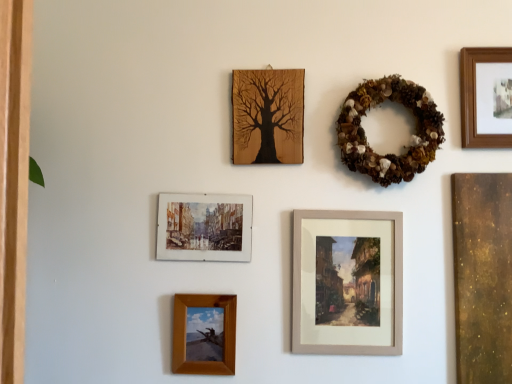
Describe the element at coordinates (347, 282) in the screenshot. I see `wooden framed painting at center, the fourth picture frame in the left-to-right sequence` at that location.

The image size is (512, 384). In order to click on wooden framed painting at center, the fourth picture frame in the left-to-right sequence in this screenshot , I will do tap(347, 282).

Find the location of a particular element. Image resolution: width=512 pixels, height=384 pixels. wooden frame at lower center, which appears as the 5th picture frame when viewed from the right is located at coordinates (204, 335).

Locate an element on the screen. Image resolution: width=512 pixels, height=384 pixels. wooden framed painting at center, placed as the 2th picture frame when sorted from right to left is located at coordinates (347, 282).

Is wooden frame at upper right, the 1th picture frame viewed from the right, oriented towards watercolor paper painting at upper left, arranged as the fourth picture frame when viewed from the right?

No.

Which object is closer to the camera taking this photo, wooden frame at upper right, which is the 5th picture frame in left-to-right order, or watercolor paper painting at upper left, the 2th picture frame when ordered from left to right?

wooden frame at upper right, which is the 5th picture frame in left-to-right order, is in front.

Locate an element on the screen. The image size is (512, 384). the 2nd picture frame located beneath the wooden frame at upper right, which is the 5th picture frame in left-to-right order (from a real-world perspective) is located at coordinates (204, 227).

Is wooden frame at upper right, the 1th picture frame viewed from the right, surrounding watercolor paper painting at upper left, arranged as the fourth picture frame when viewed from the right?

No, watercolor paper painting at upper left, arranged as the fourth picture frame when viewed from the right, is located outside of wooden frame at upper right, the 1th picture frame viewed from the right.

Which of these two, wooden framed painting at center, placed as the 2th picture frame when sorted from right to left, or watercolor paper painting at upper left, the 2th picture frame when ordered from left to right, is bigger?

wooden framed painting at center, placed as the 2th picture frame when sorted from right to left, is bigger.

Which of these two, wooden framed painting at center, placed as the 2th picture frame when sorted from right to left, or watercolor paper painting at upper left, arranged as the fourth picture frame when viewed from the right, stands shorter?

watercolor paper painting at upper left, arranged as the fourth picture frame when viewed from the right, is shorter.

Can you tell me how much wooden framed painting at center, the fourth picture frame in the left-to-right sequence, and watercolor paper painting at upper left, arranged as the fourth picture frame when viewed from the right, differ in facing direction?

They differ by 0.000639 degrees in their facing directions.

Would you say wooden framed painting at center, the fourth picture frame in the left-to-right sequence, is to the left or to the right of watercolor paper painting at upper left, the 2th picture frame when ordered from left to right, in the picture?

In the image, wooden framed painting at center, the fourth picture frame in the left-to-right sequence, appears on the right side of watercolor paper painting at upper left, the 2th picture frame when ordered from left to right.

Based on the photo, is wooden frame at lower center, which appears as the 5th picture frame when viewed from the right, bigger than watercolor paper painting at upper left, arranged as the fourth picture frame when viewed from the right?

No, wooden frame at lower center, which appears as the 5th picture frame when viewed from the right, is not bigger than watercolor paper painting at upper left, arranged as the fourth picture frame when viewed from the right.

From the image's perspective, which object appears higher, wooden frame at lower center, which appears as the 5th picture frame when viewed from the right, or watercolor paper painting at upper left, arranged as the fourth picture frame when viewed from the right?

watercolor paper painting at upper left, arranged as the fourth picture frame when viewed from the right, is shown above in the image.

From the image's perspective, starting from the watercolor paper painting at upper left, the 2th picture frame when ordered from left to right, which picture frame is the 2nd one below? Please provide its 2D coordinates.

[(204, 335)]

Is wooden frame at lower center, which appears as the 5th picture frame when viewed from the right, touching watercolor paper painting at upper left, the 2th picture frame when ordered from left to right?

There is a gap between wooden frame at lower center, which appears as the 5th picture frame when viewed from the right, and watercolor paper painting at upper left, the 2th picture frame when ordered from left to right.

Do you think wooden frame at upper right, which is the 5th picture frame in left-to-right order, is within wooden tree art at upper center, which is the third picture frame from right to left, or outside of it?

wooden frame at upper right, which is the 5th picture frame in left-to-right order, cannot be found inside wooden tree art at upper center, which is the third picture frame from right to left.

Would you say wooden frame at upper right, which is the 5th picture frame in left-to-right order, is to the left or to the right of wooden tree art at upper center, which is the third picture frame from left to right, in the picture?

Based on their positions, wooden frame at upper right, which is the 5th picture frame in left-to-right order, is located to the right of wooden tree art at upper center, which is the third picture frame from left to right.

How many degrees apart are the facing directions of wooden frame at upper right, the 1th picture frame viewed from the right, and wooden tree art at upper center, which is the third picture frame from left to right?

0.00173 degrees separate the facing orientations of wooden frame at upper right, the 1th picture frame viewed from the right, and wooden tree art at upper center, which is the third picture frame from left to right.

Locate an element on the screen. This screenshot has width=512, height=384. the 1st picture frame positioned below the wooden frame at upper right, which is the 5th picture frame in left-to-right order (from a real-world perspective) is located at coordinates (268, 116).

From a real-world perspective, which object stands above the other?

wooden tree art at upper center, which is the third picture frame from right to left, is physically above.

Does wooden framed painting at center, placed as the 2th picture frame when sorted from right to left, have a lesser height compared to wooden tree art at upper center, which is the third picture frame from left to right?

Incorrect, the height of wooden framed painting at center, placed as the 2th picture frame when sorted from right to left, does not fall short of that of wooden tree art at upper center, which is the third picture frame from left to right.

Is wooden framed painting at center, placed as the 2th picture frame when sorted from right to left, closer to the viewer compared to wooden tree art at upper center, which is the third picture frame from right to left?

Yes, it is.

Does point (346, 272) come in front of point (300, 148)?

That is True.

Is point (163, 206) positioned behind point (313, 218)?

That is True.

Is watercolor paper painting at upper left, arranged as the fourth picture frame when viewed from the right, outside of wooden framed painting at center, placed as the 2th picture frame when sorted from right to left?

That's correct, watercolor paper painting at upper left, arranged as the fourth picture frame when viewed from the right, is outside of wooden framed painting at center, placed as the 2th picture frame when sorted from right to left.

Considering the sizes of watercolor paper painting at upper left, arranged as the fourth picture frame when viewed from the right, and wooden framed painting at center, placed as the 2th picture frame when sorted from right to left, in the image, is watercolor paper painting at upper left, arranged as the fourth picture frame when viewed from the right, wider or thinner than wooden framed painting at center, placed as the 2th picture frame when sorted from right to left,?

Considering their sizes, watercolor paper painting at upper left, arranged as the fourth picture frame when viewed from the right, looks slimmer than wooden framed painting at center, placed as the 2th picture frame when sorted from right to left.

This screenshot has width=512, height=384. What are the coordinates of `picture frame lying below the wooden framed painting at center, the fourth picture frame in the left-to-right sequence (from the image's perspective)` in the screenshot? It's located at (204, 335).

Is wooden frame at lower center, which is the first picture frame in left-to-right order, in contact with wooden framed painting at center, placed as the 2th picture frame when sorted from right to left?

No, wooden frame at lower center, which is the first picture frame in left-to-right order, is not next to wooden framed painting at center, placed as the 2th picture frame when sorted from right to left.

Can you tell me how much wooden frame at lower center, which is the first picture frame in left-to-right order, and wooden framed painting at center, placed as the 2th picture frame when sorted from right to left, differ in facing direction?

wooden frame at lower center, which is the first picture frame in left-to-right order, and wooden framed painting at center, placed as the 2th picture frame when sorted from right to left, are facing 0.00539 degrees away from each other.

From the image's perspective, is wooden frame at lower center, which is the first picture frame in left-to-right order, located beneath wooden framed painting at center, placed as the 2th picture frame when sorted from right to left?

Indeed, from the image's perspective, wooden frame at lower center, which is the first picture frame in left-to-right order, is shown beneath wooden framed painting at center, placed as the 2th picture frame when sorted from right to left.

You are a GUI agent. You are given a task and a screenshot of the screen. Output one action in this format:
    pyautogui.click(x=<x>, y=<y>)
    Task: Click on the picture frame that is the 2nd object located above the watercolor paper painting at upper left, arranged as the fourth picture frame when viewed from the right (from the image's perspective)
    The image size is (512, 384).
    Given the screenshot: What is the action you would take?
    (x=486, y=97)

Where is `picture frame that is the 1st object located below the watercolor paper painting at upper left, arranged as the fourth picture frame when viewed from the right (from the image's perspective)`? The image size is (512, 384). picture frame that is the 1st object located below the watercolor paper painting at upper left, arranged as the fourth picture frame when viewed from the right (from the image's perspective) is located at coordinates 347,282.

Looking at the image, which one is located further to wooden tree art at upper center, which is the third picture frame from left to right, brown textured wreath at upper right or wooden frame at upper right, the 1th picture frame viewed from the right?

wooden frame at upper right, the 1th picture frame viewed from the right, is positioned further to the anchor wooden tree art at upper center, which is the third picture frame from left to right.

Estimate the real-world distances between objects in this image. Which object is closer to wooden frame at lower center, which appears as the 5th picture frame when viewed from the right, wooden frame at upper right, which is the 5th picture frame in left-to-right order, or wooden tree art at upper center, which is the third picture frame from left to right?

Based on the image, wooden tree art at upper center, which is the third picture frame from left to right, appears to be nearer to wooden frame at lower center, which appears as the 5th picture frame when viewed from the right.

When comparing their distances from wooden tree art at upper center, which is the third picture frame from left to right, does wooden framed painting at center, placed as the 2th picture frame when sorted from right to left, or wooden frame at lower center, which appears as the 5th picture frame when viewed from the right, seem further?

wooden frame at lower center, which appears as the 5th picture frame when viewed from the right, is positioned further to the anchor wooden tree art at upper center, which is the third picture frame from left to right.

Looking at the image, which one is located closer to brown textured wreath at upper right, wooden frame at lower center, which is the first picture frame in left-to-right order, or wooden frame at upper right, the 1th picture frame viewed from the right?

wooden frame at upper right, the 1th picture frame viewed from the right.

From the image, which object appears to be nearer to wooden tree art at upper center, which is the third picture frame from right to left, watercolor paper painting at upper left, the 2th picture frame when ordered from left to right, or brown textured wreath at upper right?

brown textured wreath at upper right is positioned closer to the anchor wooden tree art at upper center, which is the third picture frame from right to left.

Looking at the image, which one is located further to wooden tree art at upper center, which is the third picture frame from left to right, wooden frame at upper right, the 1th picture frame viewed from the right, or brown textured wreath at upper right?

The object further to wooden tree art at upper center, which is the third picture frame from left to right, is wooden frame at upper right, the 1th picture frame viewed from the right.

Based on their spatial positions, is wooden tree art at upper center, which is the third picture frame from right to left, or wooden frame at lower center, which appears as the 5th picture frame when viewed from the right, further from brown textured wreath at upper right?

wooden frame at lower center, which appears as the 5th picture frame when viewed from the right, is further to brown textured wreath at upper right.

Looking at the image, which one is located closer to wooden frame at upper right, which is the 5th picture frame in left-to-right order, wooden tree art at upper center, which is the third picture frame from left to right, or brown textured wreath at upper right?

brown textured wreath at upper right lies closer to wooden frame at upper right, which is the 5th picture frame in left-to-right order, than the other object.

The height and width of the screenshot is (384, 512). Identify the location of decor between wooden tree art at upper center, which is the third picture frame from right to left, and wooden frame at lower center, which appears as the 5th picture frame when viewed from the right, in the vertical direction. (412, 135).

At what (x,y) coordinates should I click in order to perform the action: click on decor between wooden tree art at upper center, which is the third picture frame from right to left, and wooden framed painting at center, the fourth picture frame in the left-to-right sequence, in the up-down direction. Please return your answer as a coordinate pair (x, y). The height and width of the screenshot is (384, 512). Looking at the image, I should click on (412, 135).

I want to click on decor situated between wooden frame at lower center, which appears as the 5th picture frame when viewed from the right, and wooden frame at upper right, the 1th picture frame viewed from the right, from left to right, so (412, 135).

At what (x,y) coordinates should I click in order to perform the action: click on decor between wooden frame at upper right, which is the 5th picture frame in left-to-right order, and wooden framed painting at center, the fourth picture frame in the left-to-right sequence, from top to bottom. Please return your answer as a coordinate pair (x, y). This screenshot has width=512, height=384. Looking at the image, I should click on (412, 135).